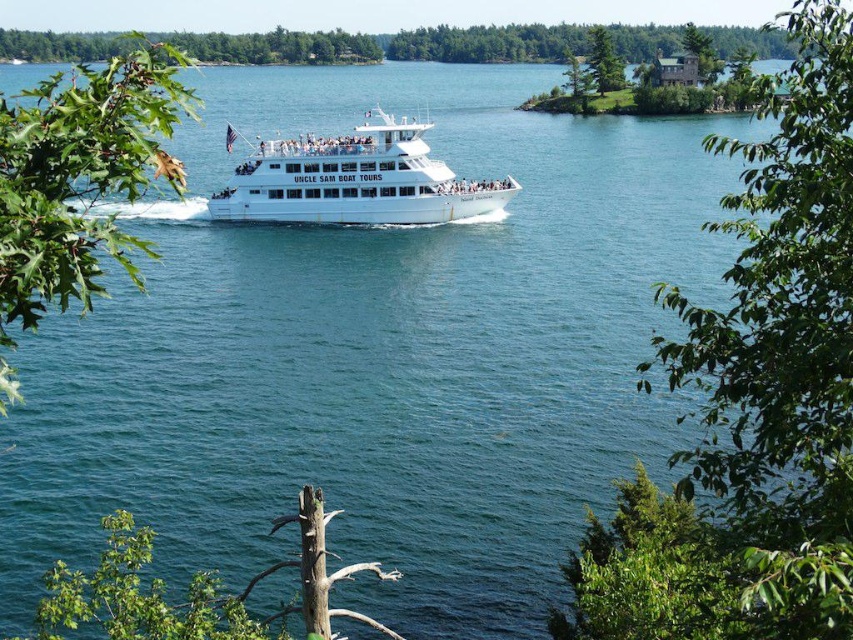
Question: Does green leafy tree at upper left appear over green textured pine tree at upper center?

Choices:
 (A) no
 (B) yes

Answer: (A)

Question: Among these points, which one is nearest to the camera?

Choices:
 (A) (138, 90)
 (B) (836, 216)

Answer: (A)

Question: Which of the following is the farthest from the observer?

Choices:
 (A) (599, 80)
 (B) (3, 236)
 (C) (492, 58)

Answer: (C)

Question: Is green leafy tree at upper left thinner than green leafy tree at upper center?

Choices:
 (A) yes
 (B) no

Answer: (A)

Question: Which of the following is the farthest from the observer?

Choices:
 (A) green textured pine tree at upper center
 (B) green leafy tree at upper right
 (C) white glossy cruise ship at center
 (D) green leafy tree at upper center

Answer: (D)

Question: Does green leafy tree at upper right come in front of white glossy cruise ship at center?

Choices:
 (A) no
 (B) yes

Answer: (B)